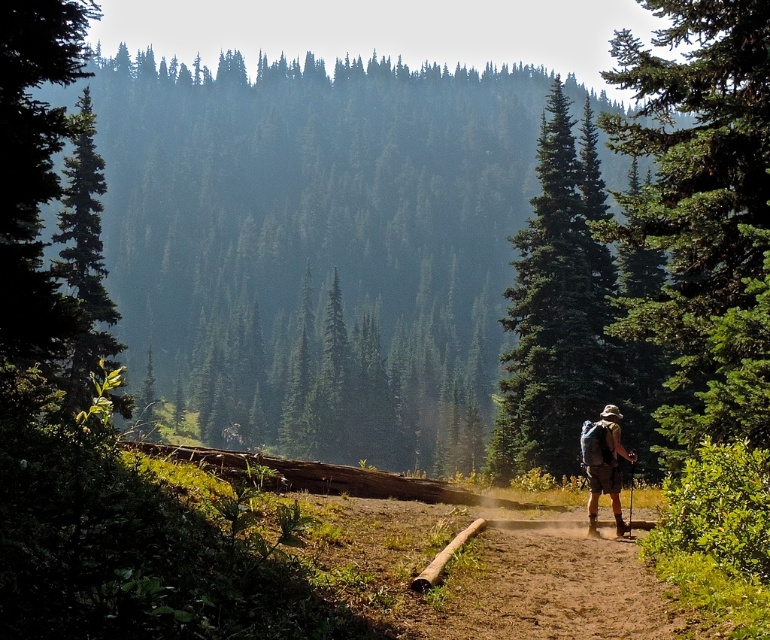
From the picture: Is the position of green matte tree at right less distant than that of green matte tree at upper left?

No.

Who is shorter, green matte tree at right or green matte tree at upper left?

green matte tree at upper left is shorter.

Is point (705, 36) farther from viewer compared to point (74, 252)?

No, it is in front of (74, 252).

Find the location of a particular element. green matte tree at right is located at coordinates coord(701,216).

Is green matte tree at right positioned at the back of green matte tree at center?

No.

Does point (711, 294) come closer to viewer compared to point (547, 451)?

Yes, point (711, 294) is in front of point (547, 451).

Does point (665, 324) lie behind point (586, 118)?

No, (665, 324) is in front of (586, 118).

What are the coordinates of `green matte tree at right` in the screenshot? It's located at tap(701, 216).

Which is behind, point (524, 433) or point (618, 412)?

The point (524, 433) is more distant.

Does green matte tree at center have a lesser width compared to camouflage fabric backpack at center?

Incorrect, green matte tree at center's width is not less than camouflage fabric backpack at center's.

Between point (558, 275) and point (618, 417), which one is positioned behind?

The point (558, 275) is more distant.

The height and width of the screenshot is (640, 770). Identify the location of green matte tree at center. (554, 307).